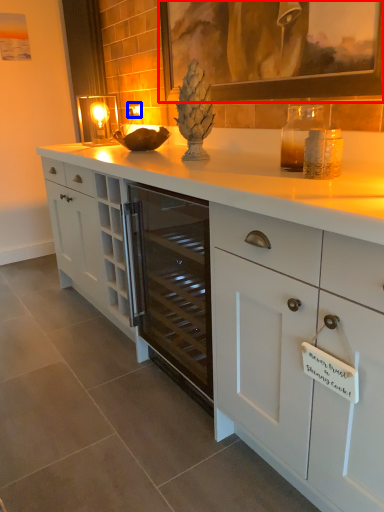
Question: Which object is closer to the camera taking this photo, picture frame (highlighted by a red box) or electric outlet (highlighted by a blue box)?

Choices:
 (A) picture frame
 (B) electric outlet

Answer: (A)